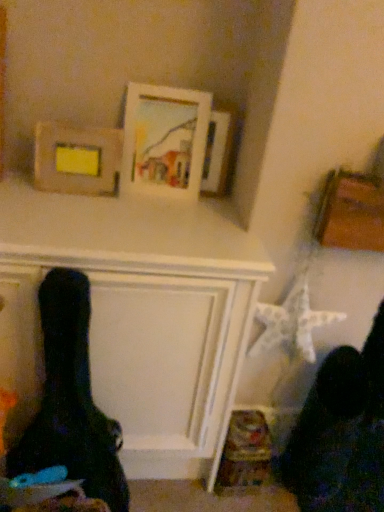
Question: Would you say wooden picture frame at upper center, which ranks as the 1th picture frame in right-to-left order, is to the left or to the right of wooden frame at upper left, which appears as the 1th picture frame when viewed from the left, in the picture?

Choices:
 (A) right
 (B) left

Answer: (A)

Question: Is wooden picture frame at upper center, the 3th picture frame in the left-to-right sequence, taller or shorter than wooden frame at upper left, which appears as the 3th picture frame when viewed from the right?

Choices:
 (A) short
 (B) tall

Answer: (B)

Question: Based on their relative distances, which object is farther from the wooden frame at upper left, which appears as the 1th picture frame when viewed from the left?

Choices:
 (A) white matte picture frame at upper center, positioned as the 2th picture frame in left-to-right order
 (B) wooden picture frame at upper center, which ranks as the 1th picture frame in right-to-left order

Answer: (B)

Question: Based on their relative distances, which object is farther from the wooden frame at upper left, which appears as the 1th picture frame when viewed from the left?

Choices:
 (A) white matte picture frame at upper center, which is the second picture frame in right-to-left order
 (B) wooden picture frame at upper center, which ranks as the 1th picture frame in right-to-left order

Answer: (B)